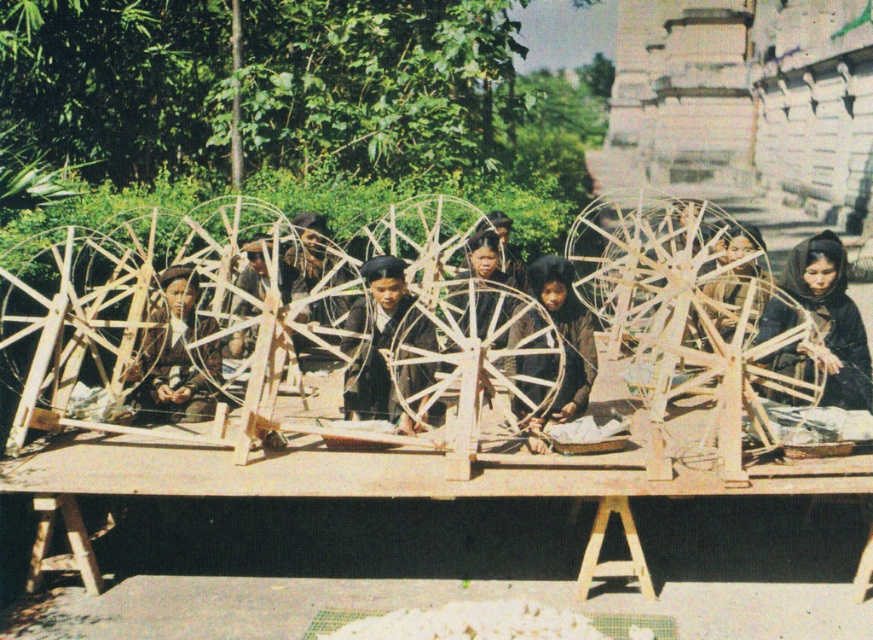
You are a visitor observing the scene and want to take a photo of the brown wooden spinning wheel at center without any obstruction. Is the brown fabric at center blocking the view of the spinning wheel?

The brown wooden spinning wheel at center is positioned over brown fabric at center, so the fabric is underneath the spinning wheel and does not block the view. You can take the photo without any obstruction.

You are a photographer standing at the camera position. You want to take a closeup photo of the dark brown wooden spinning wheel at center. Considering the distance, can you get a clear closeup without moving closer?

The dark brown wooden spinning wheel at center is 20.78 feet away from camera. Since 20.78 feet is approximately 6.33 meters, which is a reasonable distance for a photographer to capture a clear closeup using a zoom lens without needing to move closer, yes, you can get a clear closeup without moving closer.